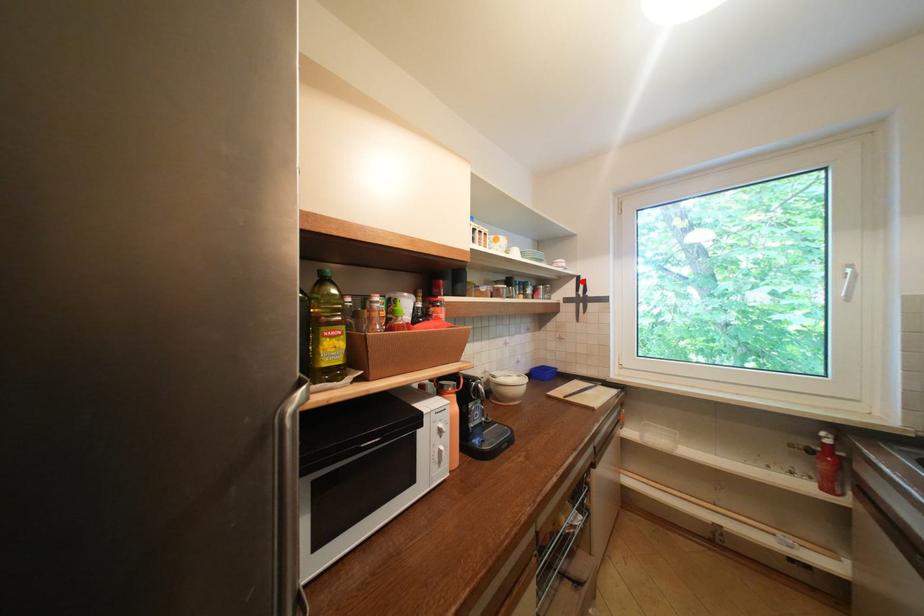
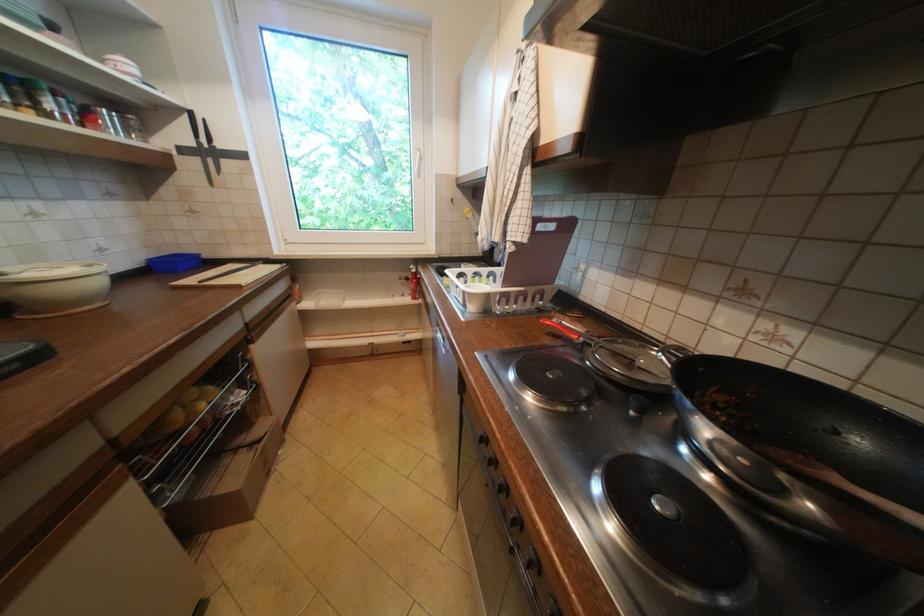
The point at the highlighted location is marked in the first image. Where is the corresponding point in the second image?

(195, 119)